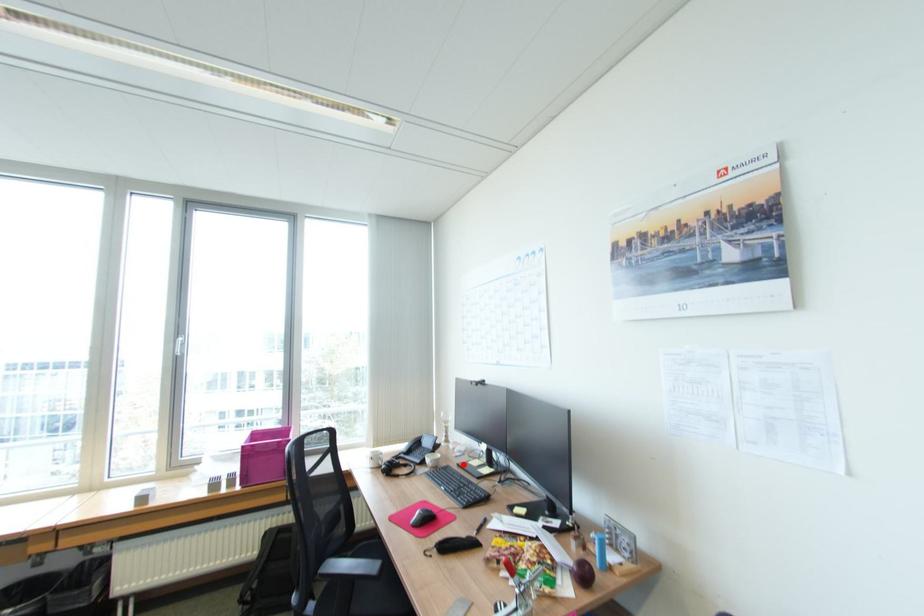
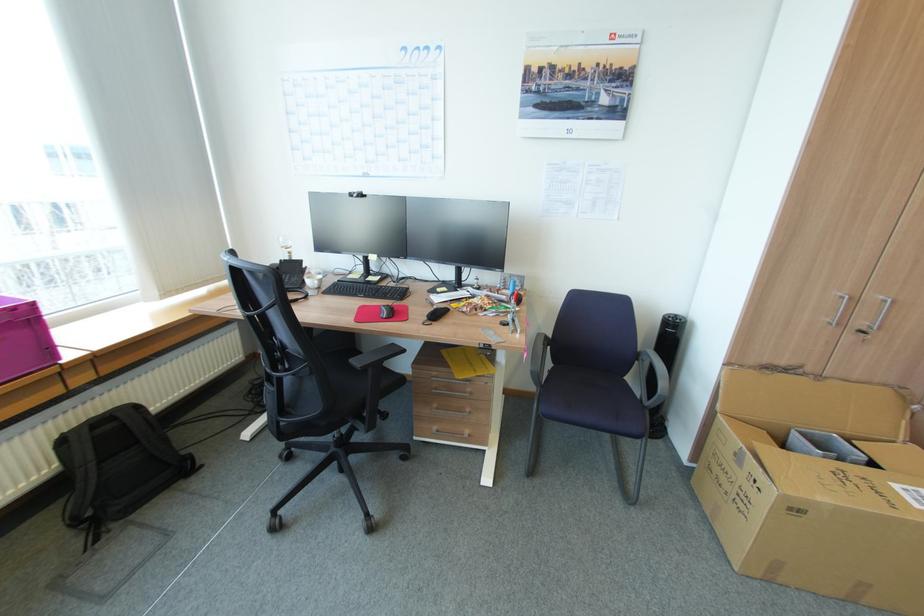
The point at the highlighted location is marked in the first image. Where is the corresponding point in the second image?

(344, 281)